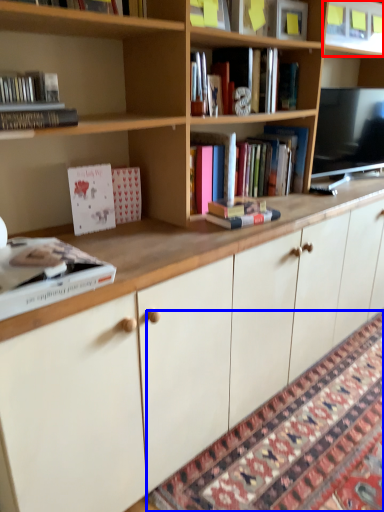
Question: Which object appears closest to the camera in this image, shelf (highlighted by a red box) or mat (highlighted by a blue box)?

Choices:
 (A) shelf
 (B) mat

Answer: (B)